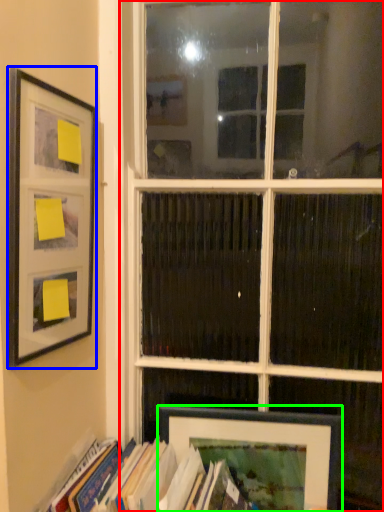
Question: Which is nearer to the window (highlighted by a red box)? picture frame (highlighted by a blue box) or picture frame (highlighted by a green box).

Choices:
 (A) picture frame
 (B) picture frame

Answer: (B)